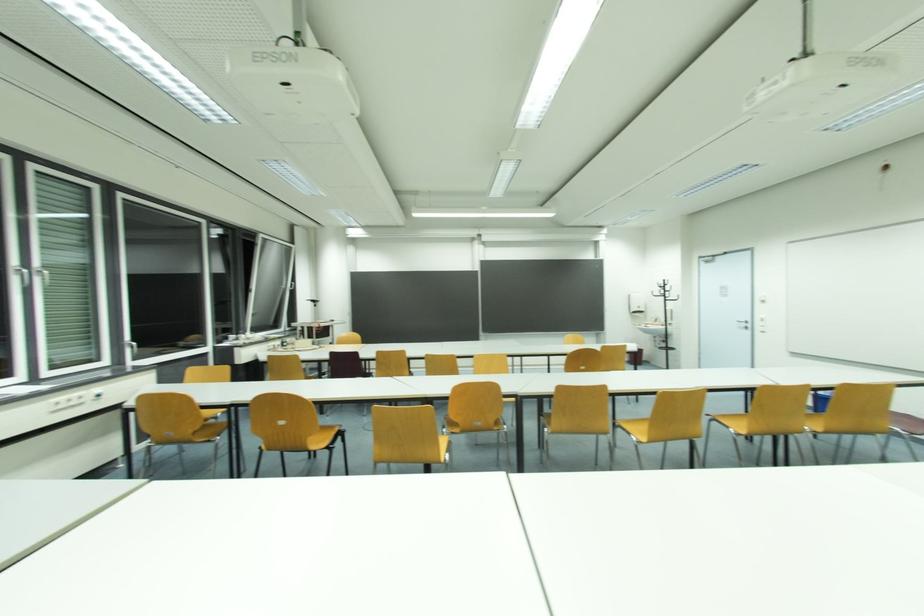
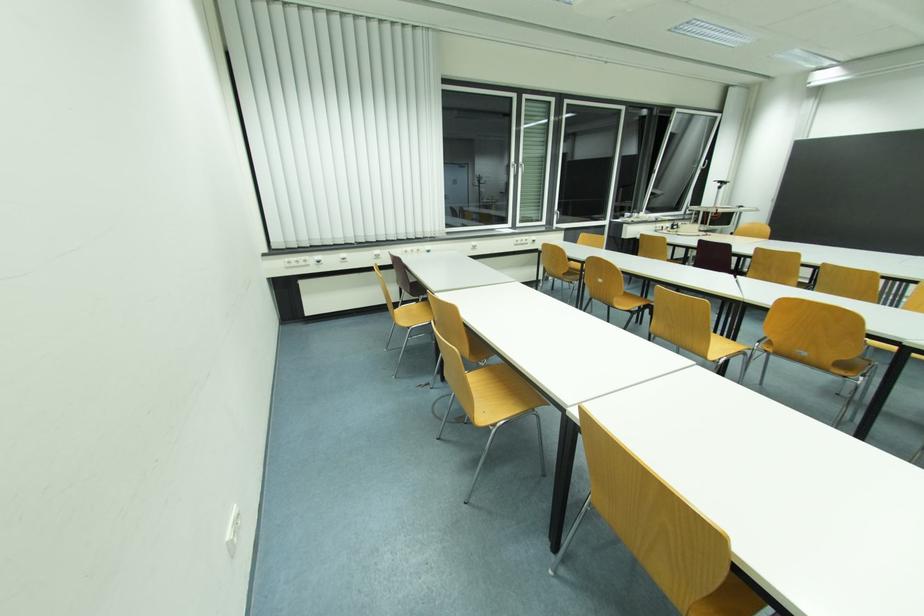
First-person continuous shooting, in which direction is the camera rotating?

The camera rotated toward left-down.